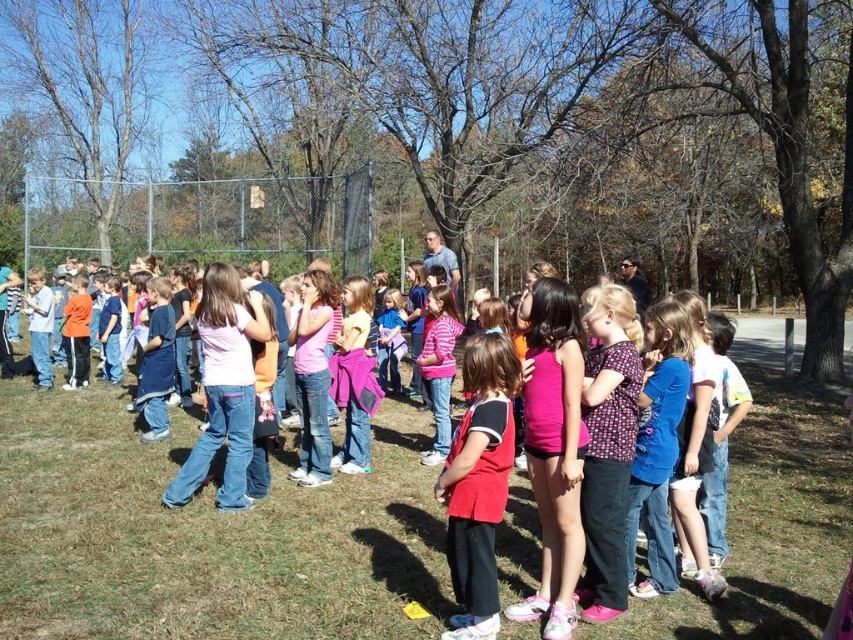
Question: Which object appears closest to the camera in this image?

Choices:
 (A) red matte shirt at center
 (B) blue denim jeans at center

Answer: (A)

Question: Can you confirm if red matte shirt at center is positioned to the right of blue denim jeans at center?

Choices:
 (A) yes
 (B) no

Answer: (B)

Question: Is red matte shirt at center above blue denim jeans at center?

Choices:
 (A) no
 (B) yes

Answer: (A)

Question: Is red matte shirt at center to the left of blue denim jeans at center from the viewer's perspective?

Choices:
 (A) no
 (B) yes

Answer: (B)

Question: Among these points, which one is nearest to the camera?

Choices:
 (A) (453, 490)
 (B) (645, 326)

Answer: (A)

Question: Which of the following is the closest to the observer?

Choices:
 (A) (474, 515)
 (B) (635, 595)

Answer: (A)